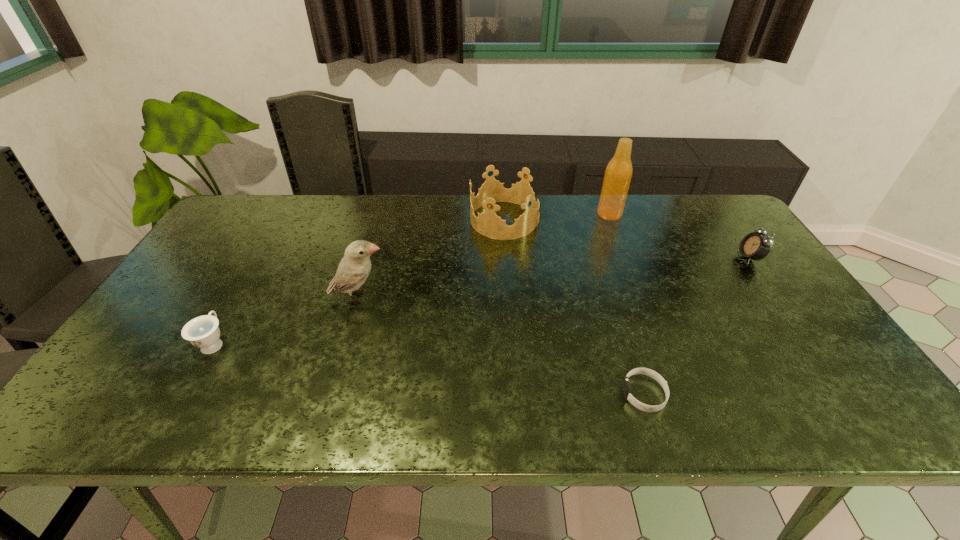
You are a GUI agent. You are given a task and a screenshot of the screen. Output one action in this format:
    pyautogui.click(x=<x>, y=<y>)
    Task: Click on the vacant position located 0.270m on the side of the teacup with the handle
    
    Given the screenshot: What is the action you would take?
    click(x=263, y=258)

The width and height of the screenshot is (960, 540). Find the location of `vacant space located on the side of the teacup with the handle`. vacant space located on the side of the teacup with the handle is located at coordinates (276, 234).

The height and width of the screenshot is (540, 960). In order to click on vacant space located 0.390m on the outer surface of the nearest object in this screenshot , I will do `click(444, 394)`.

At what (x,y) coordinates should I click in order to perform the action: click on vacant region located 0.370m on the outer surface of the nearest object. Please return your answer as a coordinate pair (x, y). This screenshot has width=960, height=540. Looking at the image, I should click on (453, 394).

The image size is (960, 540). In order to click on vacant space located 0.070m on the outer surface of the nearest object in this screenshot , I will do `click(590, 394)`.

The image size is (960, 540). Identify the location of beer bottle that is at the far edge. (618, 173).

What are the coordinates of `tiara positioned at the far edge` in the screenshot? It's located at (488, 224).

At what (x,y) coordinates should I click in order to perform the action: click on object located in the near edge section of the desktop. Please return your answer as a coordinate pair (x, y). Image resolution: width=960 pixels, height=540 pixels. Looking at the image, I should click on (626, 388).

Locate an element on the screen. Image resolution: width=960 pixels, height=540 pixels. object that is at the left edge is located at coordinates pos(203,332).

Image resolution: width=960 pixels, height=540 pixels. Identify the location of object positioned at the right edge. (755, 245).